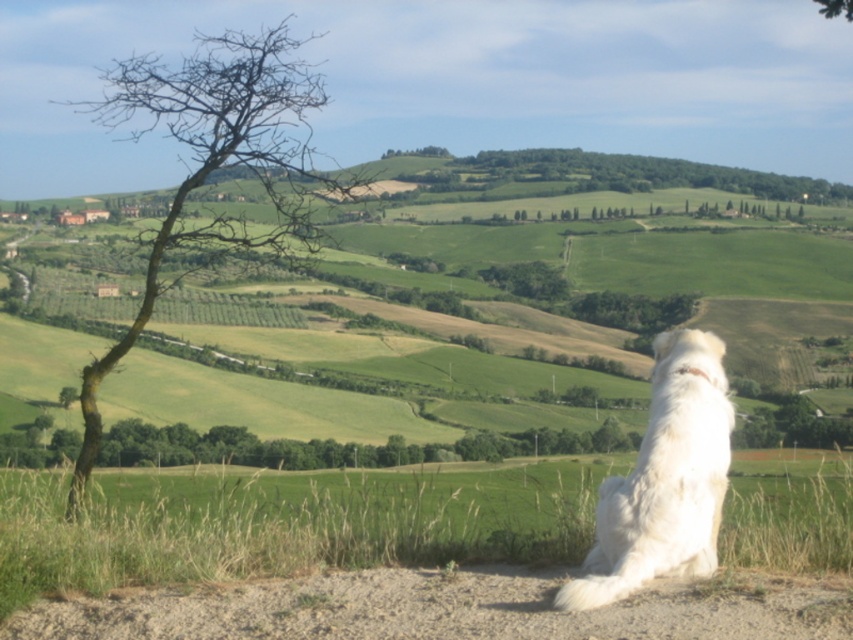
Question: Considering the relative positions of bare branches at left and white fluffy dog at lower right in the image provided, where is bare branches at left located with respect to white fluffy dog at lower right?

Choices:
 (A) below
 (B) above

Answer: (B)

Question: Does green grassy hillside at center come behind bare branches at left?

Choices:
 (A) yes
 (B) no

Answer: (A)

Question: Which of the following is the closest to the observer?

Choices:
 (A) (457, 394)
 (B) (268, 120)

Answer: (B)

Question: Among these points, which one is nearest to the camera?

Choices:
 (A) (653, 493)
 (B) (167, 76)
 (C) (241, 413)

Answer: (A)

Question: Which point is farther to the camera?

Choices:
 (A) (250, 76)
 (B) (111, 300)

Answer: (B)

Question: Does green grassy hillside at center have a lesser width compared to bare branches at left?

Choices:
 (A) yes
 (B) no

Answer: (A)